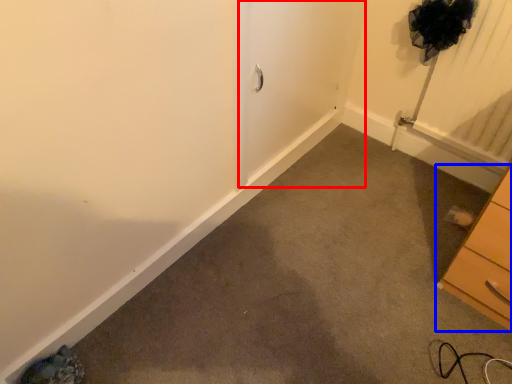
Question: Among these objects, which one is nearest to the camera, screen door (highlighted by a red box) or chest of drawers (highlighted by a blue box)?

Choices:
 (A) screen door
 (B) chest of drawers

Answer: (B)